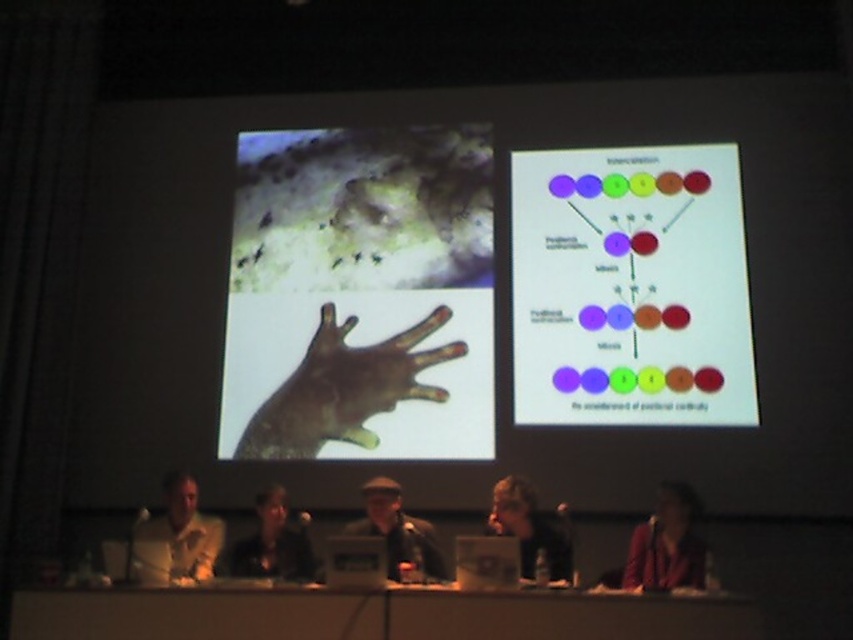
Question: Is brown matte hand at center bigger than yellow matte shirt at left?

Choices:
 (A) yes
 (B) no

Answer: (A)

Question: Which object is the closest to the smooth wooden table at center?

Choices:
 (A) dark brown leather jacket at center
 (B) yellow matte shirt at left

Answer: (A)

Question: Which object appears closest to the camera in this image?

Choices:
 (A) dark brown leather jacket at center
 (B) smooth black hair at lower center

Answer: (A)

Question: Is matte plastic hand at center in front of matte pink shirt at lower right?

Choices:
 (A) no
 (B) yes

Answer: (A)

Question: Which of these objects is positioned farthest from the matte plastic hand at center?

Choices:
 (A) dark brown leather jacket at center
 (B) matte pink shirt at lower right
 (C) yellow matte shirt at left
 (D) smooth black hair at lower center

Answer: (B)

Question: Does matte pink shirt at lower right appear on the left side of dark brown leather jacket at center?

Choices:
 (A) no
 (B) yes

Answer: (A)